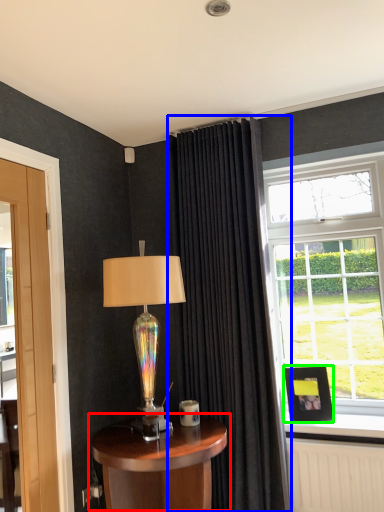
Question: Based on their relative distances, which object is farther from table (highlighted by a red box)? Choose from curtain (highlighted by a blue box) and picture frame (highlighted by a green box).

Choices:
 (A) curtain
 (B) picture frame

Answer: (B)